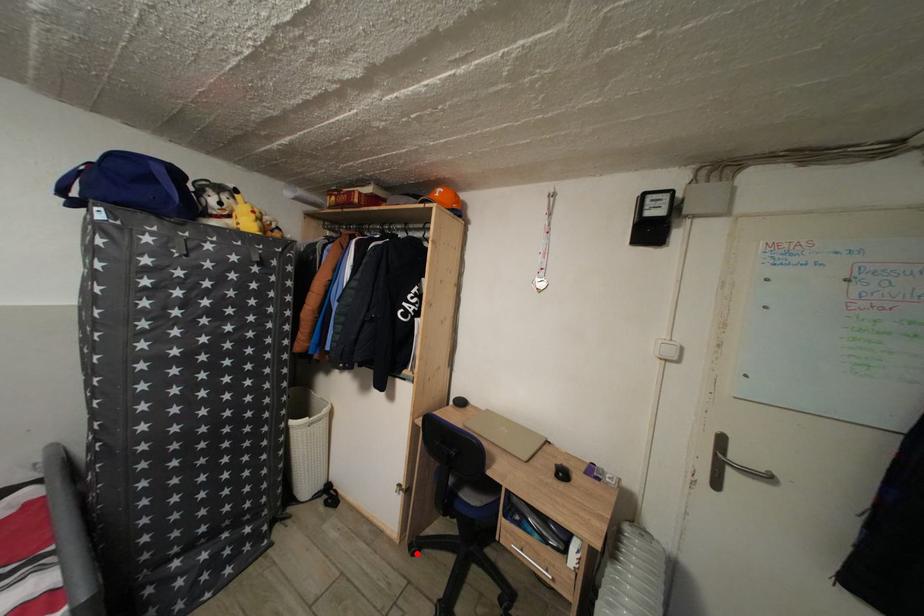
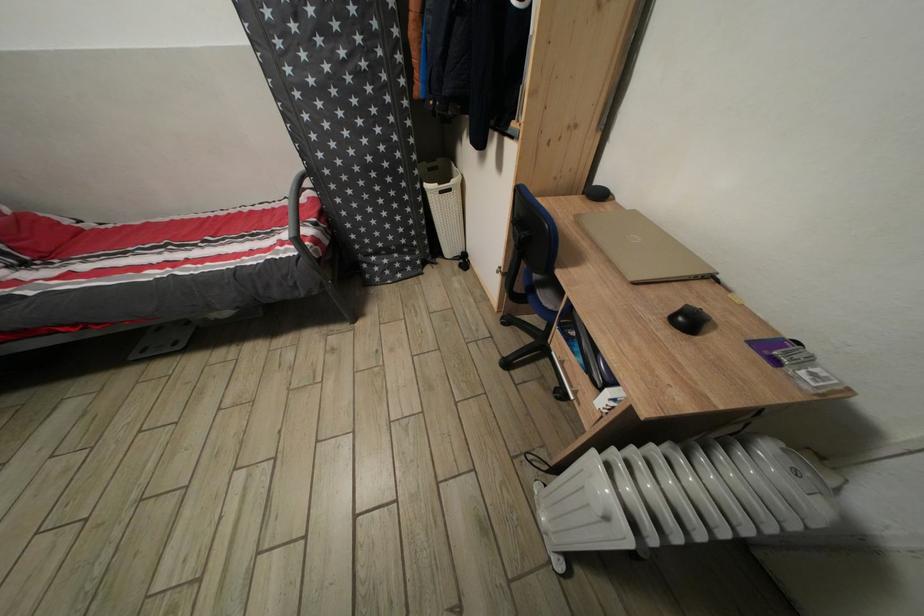
Question: A red point is marked in image1. In image2, is the corresponding 3D point closer to the camera or farther? Reply with the corresponding letter.

Choices:
 (A) The corresponding 3D point is closer.
 (B) The corresponding 3D point is farther.

Answer: (A)